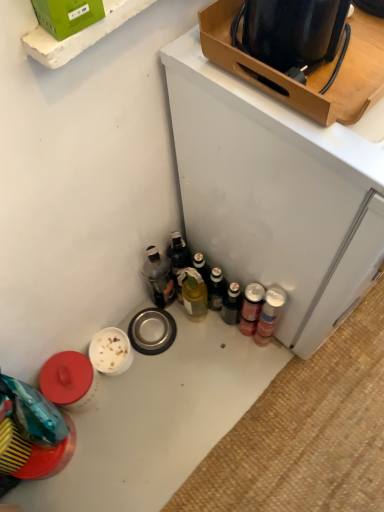
Question: From the image's perspective, is metallic silver can at lower right, the 4th bottle in the left-to-right sequence, under metallic silver can at lower right?

Choices:
 (A) yes
 (B) no

Answer: (A)

Question: Can you confirm if metallic silver can at lower right, the 4th bottle in the left-to-right sequence, is thinner than metallic silver can at lower right?

Choices:
 (A) yes
 (B) no

Answer: (B)

Question: Is metallic silver can at lower right, which ranks as the 1th bottle in right-to-left order, at the right side of metallic silver can at lower right?

Choices:
 (A) yes
 (B) no

Answer: (A)

Question: Is metallic silver can at lower right, the 4th bottle in the left-to-right sequence, in contact with metallic silver can at lower right?

Choices:
 (A) yes
 (B) no

Answer: (A)

Question: Can we say metallic silver can at lower right, the 4th bottle in the left-to-right sequence, lies outside metallic silver can at lower right?

Choices:
 (A) yes
 (B) no

Answer: (A)

Question: Is metallic silver can at lower right, the 4th bottle in the left-to-right sequence, positioned with its back to metallic silver can at lower right?

Choices:
 (A) yes
 (B) no

Answer: (A)

Question: From a real-world perspective, is translucent glass bottle at center, which is the 3th bottle from left to right, below translucent plastic bottle at center, the third bottle viewed from the right?

Choices:
 (A) yes
 (B) no

Answer: (B)

Question: From the image's perspective, is translucent glass bottle at center, the second bottle when ordered from right to left, on top of translucent plastic bottle at center, placed as the 2th bottle when sorted from left to right?

Choices:
 (A) yes
 (B) no

Answer: (B)

Question: Is translucent glass bottle at center, the second bottle when ordered from right to left, facing towards translucent plastic bottle at center, the third bottle viewed from the right?

Choices:
 (A) no
 (B) yes

Answer: (A)

Question: Is translucent glass bottle at center, which is the 3th bottle from left to right, in contact with translucent plastic bottle at center, the third bottle viewed from the right?

Choices:
 (A) no
 (B) yes

Answer: (B)

Question: Are translucent glass bottle at center, the second bottle when ordered from right to left, and translucent plastic bottle at center, the third bottle viewed from the right, located far from each other?

Choices:
 (A) no
 (B) yes

Answer: (A)

Question: Is translucent glass bottle at center, the second bottle when ordered from right to left, shorter than translucent plastic bottle at center, placed as the 2th bottle when sorted from left to right?

Choices:
 (A) yes
 (B) no

Answer: (B)

Question: From the image's perspective, does white glossy table at lower left appear higher than metallic silver canisters at lower right?

Choices:
 (A) no
 (B) yes

Answer: (A)